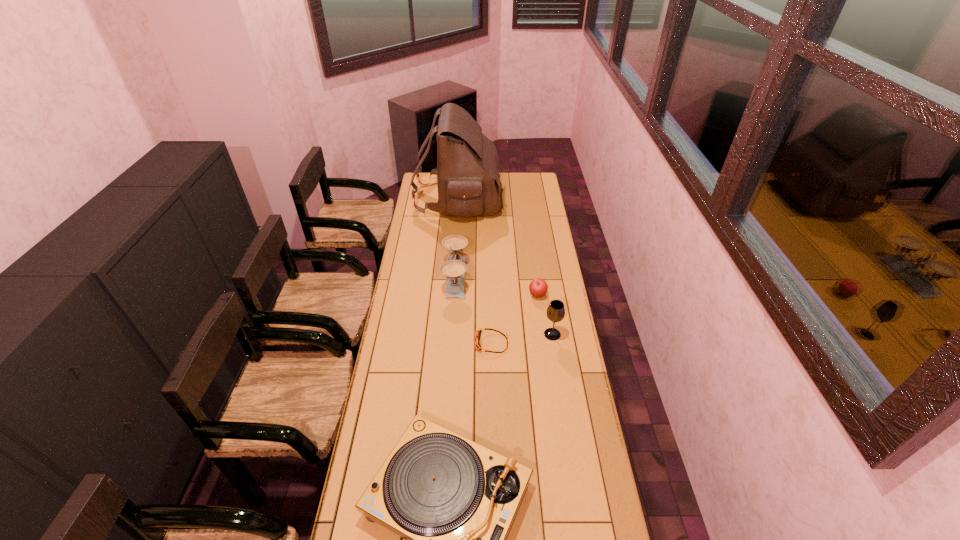
At what (x,y) coordinates should I click in order to perform the action: click on vacant space at the far right corner of the desktop. Please return your answer as a coordinate pair (x, y). This screenshot has height=540, width=960. Looking at the image, I should click on (516, 178).

In order to click on unoccupied area between the goggles and the wineglass in this screenshot , I will do `click(522, 339)`.

Where is `free space between the scale and the apple`? The height and width of the screenshot is (540, 960). free space between the scale and the apple is located at coordinates (496, 286).

Locate an element on the screen. vacant area that lies between the satchel and the wineglass is located at coordinates (505, 266).

At what (x,y) coordinates should I click in order to perform the action: click on vacant area that lies between the wineglass and the scale. Please return your answer as a coordinate pair (x, y). Looking at the image, I should click on (504, 306).

Identify the location of blank region between the wineglass and the scale. This screenshot has width=960, height=540. (504, 306).

Image resolution: width=960 pixels, height=540 pixels. I want to click on vacant region between the shortest object and the wineglass, so click(x=522, y=339).

Find the location of a particular element. object that is the closest to the nearest object is located at coordinates (478, 347).

The image size is (960, 540). Find the location of `the fifth closest object to the apple`. the fifth closest object to the apple is located at coordinates (453, 500).

Where is `vacant space that satisfies the following two spatial constraints: 1. on the front-facing side of the wineglass; 2. on the left side of the scale`? vacant space that satisfies the following two spatial constraints: 1. on the front-facing side of the wineglass; 2. on the left side of the scale is located at coordinates (452, 334).